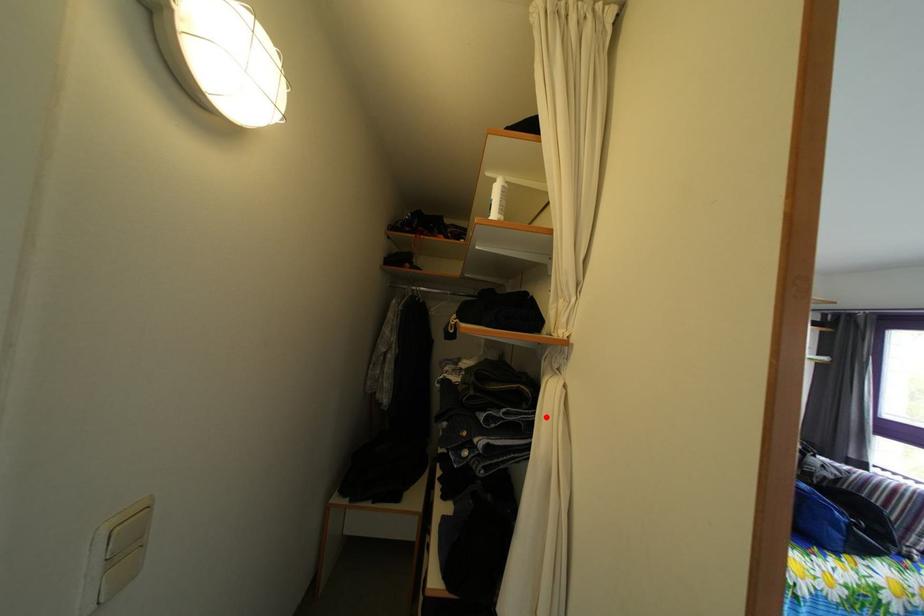
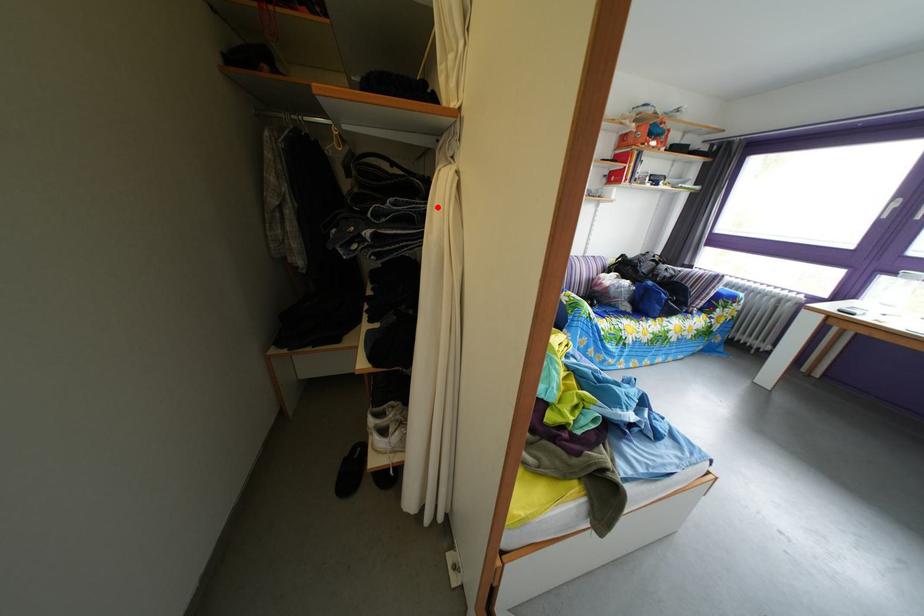
I am providing you with two images of the same scene from different viewpoints. A red point is marked on the first image and another point is marked on the second image. Are the points marked in image1 and image2 representing the same 3D position?

Yes